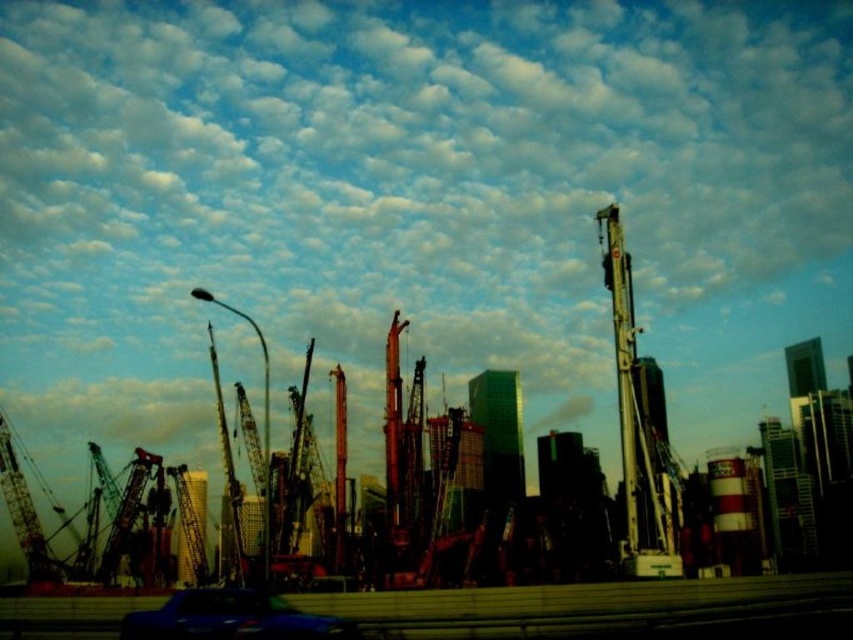
Can you confirm if metallic gray crane at right is positioned to the left of metallic blue car at lower center?

Incorrect, metallic gray crane at right is not on the left side of metallic blue car at lower center.

Describe the element at coordinates (635, 426) in the screenshot. I see `metallic gray crane at right` at that location.

Does point (653, 554) lie in front of point (286, 616)?

No, it is not.

Locate an element on the screen. metallic gray crane at right is located at coordinates (635, 426).